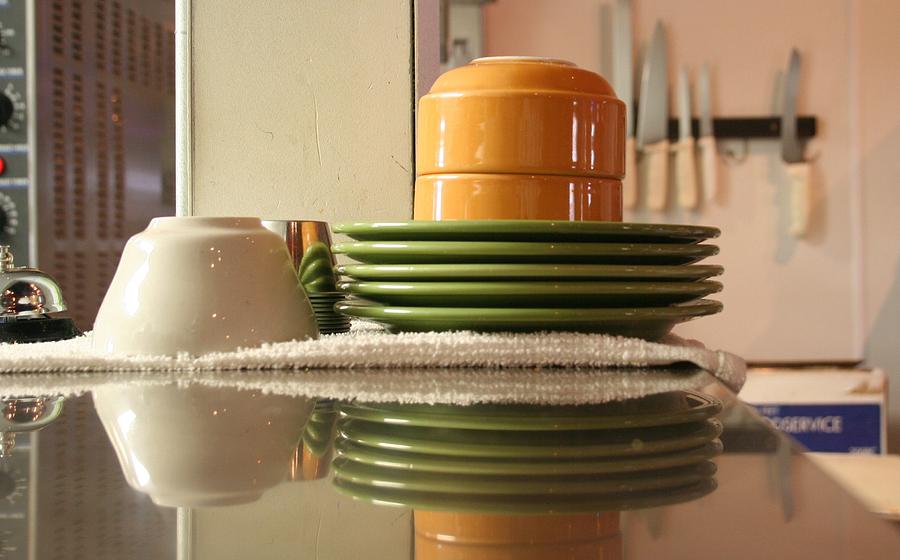
The height and width of the screenshot is (560, 900). Identify the location of plates. (518, 320), (511, 294), (508, 272), (507, 246), (502, 228).